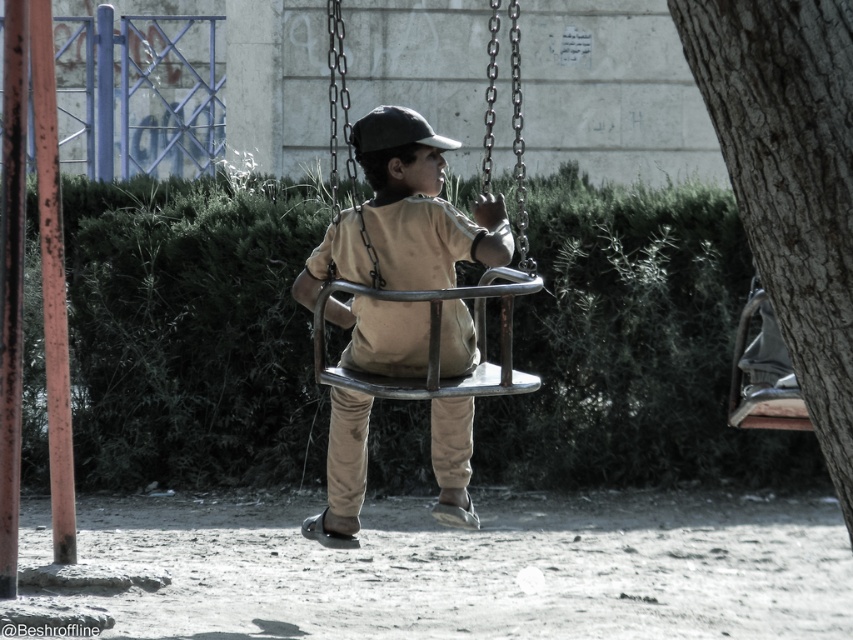
You are standing at the point with coordinates point (422, 358) and want to walk to the point with coordinates point (845, 368). Which direction should you face to walk towards your destination?

You should face forward because point (845, 368) is in front of point (422, 358).

You are a parent trying to ensure your child can safely sit on the metallic swing at center without the black matte baseball hat at center falling off. Based on their sizes, is the hat likely to stay on the child if they move around?

The metallic swing at center might be wider than black matte baseball hat at center, so the hat is smaller and less likely to fall off when the child moves around.

You are a parent trying to decide whether to let your child play on the matte brown swing at center. You notice the smooth bark tree at right nearby. Based on their heights, is the tree shorter or taller than the swing?

The smooth bark tree at right is shorter than the matte brown swing at center, so the tree is shorter than the swing.